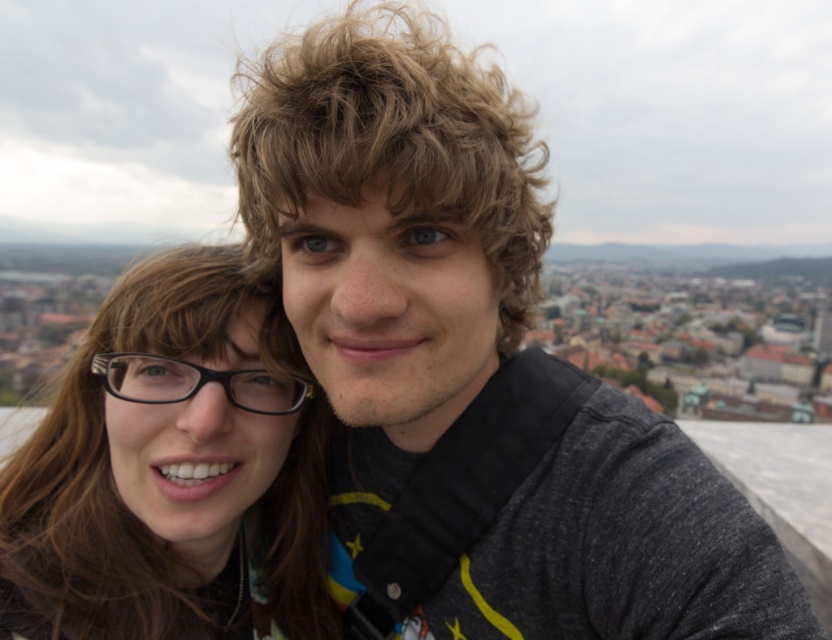
Is point (419, 154) closer to viewer compared to point (226, 563)?

Yes, point (419, 154) is in front of point (226, 563).

Is gray fabric jacket at center bigger than matte black glasses at left?

Yes, gray fabric jacket at center is bigger than matte black glasses at left.

Who is more forward, (308, 323) or (70, 588)?

Point (70, 588) is in front.

Locate an element on the screen. The width and height of the screenshot is (832, 640). gray fabric jacket at center is located at coordinates (390, 234).